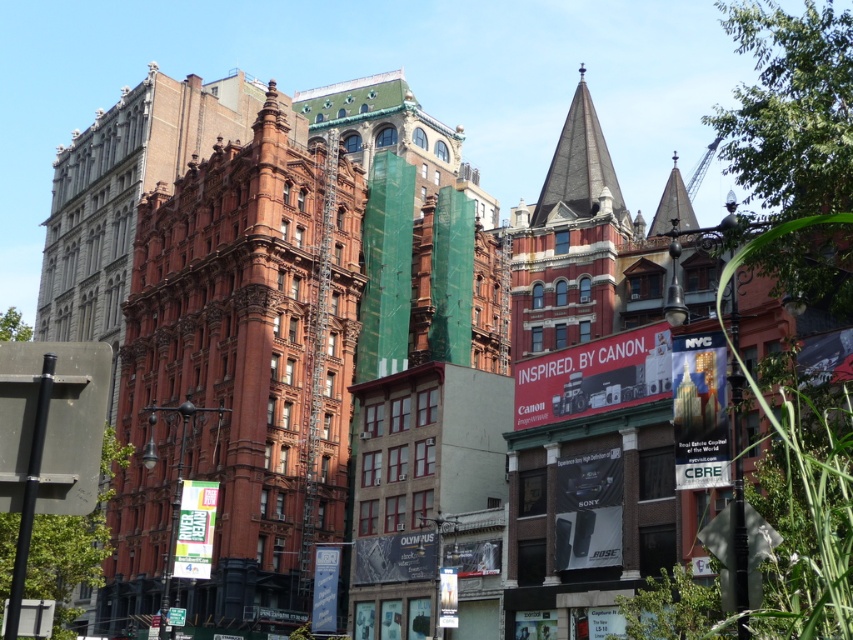
Looking at the urban scene, which object is positioned to the left of the other between the red brick building at center and the dark gray slate spire at upper center?

The red brick building at center is positioned to the left of the dark gray slate spire at upper center.

You are a city planner assessing the urban layout. Given the red brick building at center and the dark gray slate spire at upper center, which structure would require more space for construction planning?

The red brick building at center has a larger size compared to the dark gray slate spire at upper center, so it would require more space for construction planning.

Based on the photo, you are a city planner reviewing this urban layout. The red brick building at center is located at coordinates 0.588, 0.281. If you need to place a new public bench exactly 0.1 units north of this building, what would be the new coordinates for the bench?

The new coordinates for the bench would be approximately (154, 376), since moving north decreases the y coordinate by 0.1 units from the red brick building at center located at (239, 376).